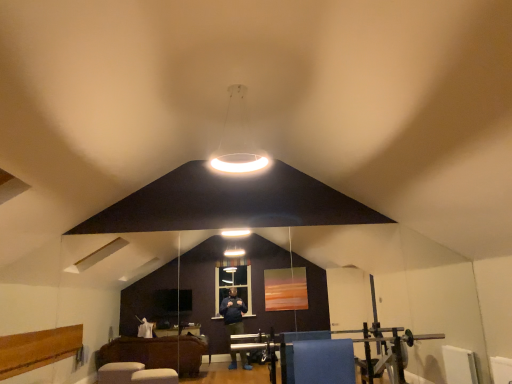
I want to click on vacant point above white glossy ring light at center (from a real-world perspective), so click(238, 83).